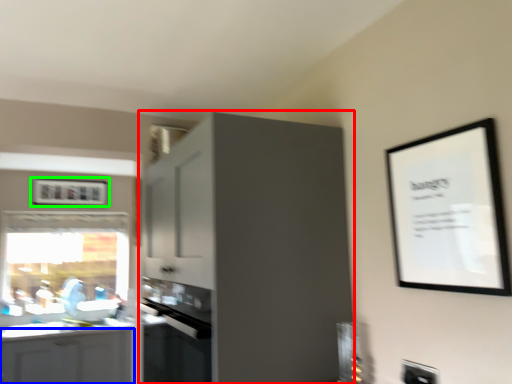
Question: Which object is the farthest from cabinetry (highlighted by a red box)? Choose among these: cabinetry (highlighted by a blue box) or picture frame (highlighted by a green box).

Choices:
 (A) cabinetry
 (B) picture frame

Answer: (B)